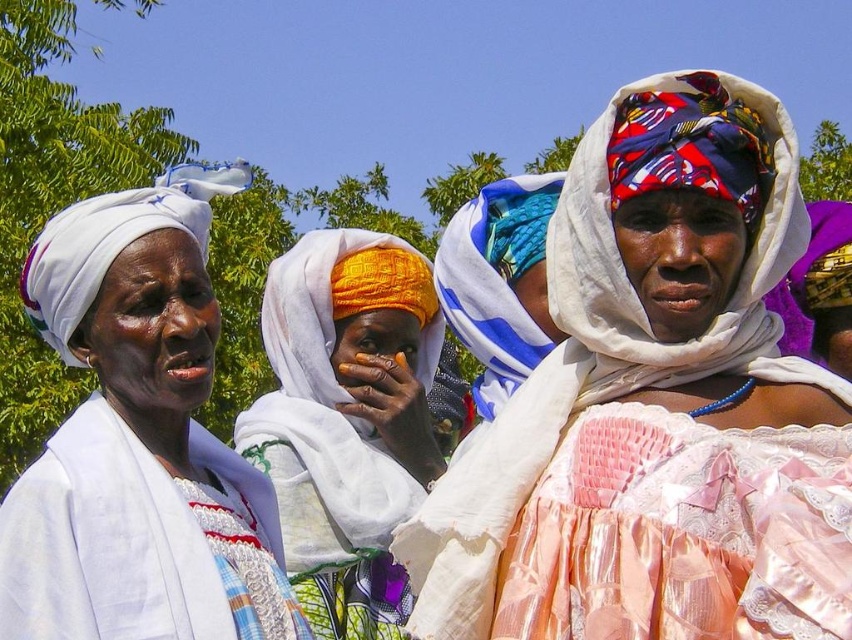
Between point (338, 621) and point (545, 211), which one is positioned in front?

Point (338, 621)

Which is in front, point (289, 444) or point (536, 291)?

Positioned in front is point (289, 444).

The height and width of the screenshot is (640, 852). In order to click on matte yellow fabric headscarf at center in this screenshot , I will do `click(347, 420)`.

Can you confirm if white woven cloth at left is thinner than blue and white woven fabric at center?

In fact, white woven cloth at left might be wider than blue and white woven fabric at center.

Can you confirm if white woven cloth at left is bigger than blue and white woven fabric at center?

Correct, white woven cloth at left is larger in size than blue and white woven fabric at center.

Is point (85, 312) behind point (498, 314)?

No, it is not.

Locate an element on the screen. The image size is (852, 640). white woven cloth at left is located at coordinates (108, 541).

Can you confirm if shiny silk dress at center is bigger than matte yellow fabric headscarf at center?

Yes.

Is point (676, 189) more distant than point (396, 524)?

No, (676, 189) is in front of (396, 524).

Between point (792, 205) and point (378, 540), which one is positioned behind?

The point (378, 540) is more distant.

You are a GUI agent. You are given a task and a screenshot of the screen. Output one action in this format:
    pyautogui.click(x=<x>, y=<y>)
    Task: Click on the shiny silk dress at center
    
    Given the screenshot: What is the action you would take?
    pyautogui.click(x=655, y=406)